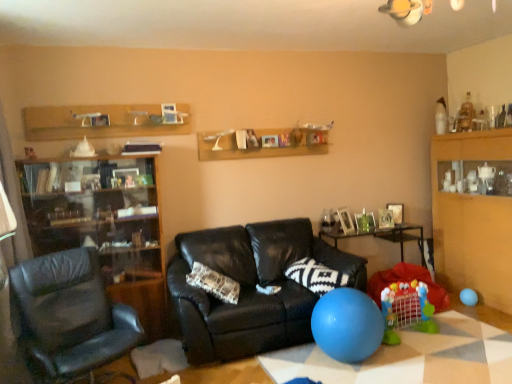
You are a GUI agent. You are given a task and a screenshot of the screen. Output one action in this format:
    pyautogui.click(x=<x>, y=<y>)
    Task: Click on the black leather chair at left
    
    Given the screenshot: What is the action you would take?
    pyautogui.click(x=71, y=316)

The image size is (512, 384). What do you see at coordinates (71, 316) in the screenshot?
I see `black leather chair at left` at bounding box center [71, 316].

In order to face blue rubber balloon at lower center, the 1th balloon from the left, should I rotate leftwards or rightwards?

Turn right by 12.293 degrees to look at blue rubber balloon at lower center, the 1th balloon from the left.

In order to face blue rubber balloon at lower right, positioned as the 1th balloon in back-to-front order, should I rotate leftwards or rightwards?

A 26.725 degree turn to the right will do.

You are a GUI agent. You are given a task and a screenshot of the screen. Output one action in this format:
    pyautogui.click(x=<x>, y=<y>)
    Task: Click on the matte black cabinet at left
    This screenshot has height=384, width=512.
    Given the screenshot: What is the action you would take?
    pyautogui.click(x=103, y=225)

Where is `blue rubber ball at lower center, acting as the second table starting from the top`? Image resolution: width=512 pixels, height=384 pixels. blue rubber ball at lower center, acting as the second table starting from the top is located at coordinates (410, 357).

Image resolution: width=512 pixels, height=384 pixels. What do you see at coordinates (410, 357) in the screenshot? I see `blue rubber ball at lower center, which is counted as the second table, starting from the back` at bounding box center [410, 357].

Where is `black leather couch at center`? black leather couch at center is located at coordinates (251, 288).

From a real-world perspective, between black leather couch at center and wooden glossy table at center, acting as the first table starting from the top, who is vertically higher?

black leather couch at center.

Is black leather couch at center in front of or behind wooden glossy table at center, the 1th table positioned from the back, in the image?

black leather couch at center is in front of wooden glossy table at center, the 1th table positioned from the back.

Can you tell me how much black leather couch at center and wooden glossy table at center, the second table in the front-to-back sequence, differ in facing direction?

4.39 degrees.

Identify the location of table that is the 1st one below the black leather couch at center (from a real-world perspective). The image size is (512, 384). (387, 237).

Who is smaller, blue rubber balloon at lower right, positioned as the 1th balloon in back-to-front order, or blue rubber ball at lower center, which is counted as the second table, starting from the back?

blue rubber balloon at lower right, positioned as the 1th balloon in back-to-front order.

Is blue rubber balloon at lower right, which is the 2th balloon in front-to-back order, further to camera compared to blue rubber ball at lower center, the first table from the front?

Yes, blue rubber balloon at lower right, which is the 2th balloon in front-to-back order, is further from the camera.

Considering the points (461, 301) and (494, 376), which point is in front, point (461, 301) or point (494, 376)?

Point (494, 376)

Consider the image. Are blue rubber balloon at lower right, positioned as the 1th balloon in back-to-front order, and blue rubber ball at lower center, which is the 1th table from bottom to top, making contact?

There is a gap between blue rubber balloon at lower right, positioned as the 1th balloon in back-to-front order, and blue rubber ball at lower center, which is the 1th table from bottom to top.

Is blue rubber balloon at lower center, the 1th balloon from the left, far from wooden glossy table at center, which is counted as the 2th table, starting from the bottom?

Indeed, blue rubber balloon at lower center, the 1th balloon from the left, is not near wooden glossy table at center, which is counted as the 2th table, starting from the bottom.

Which is correct: blue rubber balloon at lower center, the 1th balloon from the left, is inside wooden glossy table at center, the second table in the front-to-back sequence, or outside of it?

blue rubber balloon at lower center, the 1th balloon from the left, lies outside wooden glossy table at center, the second table in the front-to-back sequence.

At what (x,y) coordinates should I click in order to perform the action: click on the 2nd balloon in front of the wooden glossy table at center, which is counted as the 2th table, starting from the bottom. Please return your answer as a coordinate pair (x, y). Looking at the image, I should click on (347, 325).

Does point (340, 284) lie behind point (334, 329)?

Yes, point (340, 284) is farther from viewer.

How far apart are black and white patterned pillow at center and blue rubber balloon at lower center, the 1th balloon positioned from the front?

black and white patterned pillow at center is 14.04 inches away from blue rubber balloon at lower center, the 1th balloon positioned from the front.

Who is bigger, black and white patterned pillow at center or blue rubber balloon at lower center, the 1th balloon positioned from the front?

blue rubber balloon at lower center, the 1th balloon positioned from the front.

How different are the orientations of blue rubber balloon at lower right, placed as the second balloon when sorted from left to right, and wooden glossy table at center, the 1th table positioned from the back, in degrees?

There is a 2.06-degree angle between the facing directions of blue rubber balloon at lower right, placed as the second balloon when sorted from left to right, and wooden glossy table at center, the 1th table positioned from the back.

Can you confirm if blue rubber balloon at lower right, which is the 2th balloon in front-to-back order, is taller than wooden glossy table at center, acting as the first table starting from the top?

In fact, blue rubber balloon at lower right, which is the 2th balloon in front-to-back order, may be shorter than wooden glossy table at center, acting as the first table starting from the top.

Based on the photo, from the image's perspective, is blue rubber balloon at lower right, positioned as the 1th balloon in back-to-front order, located above or below wooden glossy table at center, acting as the first table starting from the top?

blue rubber balloon at lower right, positioned as the 1th balloon in back-to-front order, is situated lower than wooden glossy table at center, acting as the first table starting from the top, in the image.

Looking at this image, between blue rubber balloon at lower right, positioned as the 1th balloon in back-to-front order, and wooden glossy table at center, acting as the first table starting from the top, which one is positioned in front?

blue rubber balloon at lower right, positioned as the 1th balloon in back-to-front order.

In the image, is wooden cabinet at right positioned in front of or behind blue rubber ball at lower center, the first table from the front?

Visually, wooden cabinet at right is located behind blue rubber ball at lower center, the first table from the front.

Does wooden cabinet at right appear on the left side of blue rubber ball at lower center, acting as the second table starting from the top?

In fact, wooden cabinet at right is to the right of blue rubber ball at lower center, acting as the second table starting from the top.

Is wooden cabinet at right shorter than blue rubber ball at lower center, which is the 1th table from bottom to top?

No, wooden cabinet at right is not shorter than blue rubber ball at lower center, which is the 1th table from bottom to top.

Between wooden cabinet at right and blue rubber ball at lower center, the first table from the front, which one has larger size?

Bigger between the two is wooden cabinet at right.

Based on the photo, considering the relative sizes of wooden glossy table at center, the second table in the front-to-back sequence, and black leather couch at center in the image provided, is wooden glossy table at center, the second table in the front-to-back sequence, smaller than black leather couch at center?

Yes.

From the image's perspective, is wooden glossy table at center, acting as the first table starting from the top, located above black leather couch at center?

Correct, wooden glossy table at center, acting as the first table starting from the top, appears higher than black leather couch at center in the image.

In terms of height, does wooden glossy table at center, which is counted as the 2th table, starting from the bottom, look taller or shorter compared to black leather couch at center?

Considering their sizes, wooden glossy table at center, which is counted as the 2th table, starting from the bottom, has less height than black leather couch at center.

Does point (422, 227) appear closer or farther from the camera than point (201, 259)?

Point (422, 227).

At what (x,y) coordinates should I click in order to perform the action: click on table above the black leather couch at center (from the image's perspective). Please return your answer as a coordinate pair (x, y). The width and height of the screenshot is (512, 384). Looking at the image, I should click on (387, 237).

Image resolution: width=512 pixels, height=384 pixels. Find the location of `table in front of the blue rubber balloon at lower right, placed as the second balloon when sorted from left to right`. table in front of the blue rubber balloon at lower right, placed as the second balloon when sorted from left to right is located at coordinates (410, 357).

Considering their positions, is blue rubber ball at lower center, which is the 1th table from bottom to top, positioned closer to black and white patterned pillow at center than wooden glossy table at center, the 1th table positioned from the back?

blue rubber ball at lower center, which is the 1th table from bottom to top, is positioned closer to the anchor black and white patterned pillow at center.

Estimate the real-world distances between objects in this image. Which object is closer to black and white patterned pillow at center, black leather couch at center or blue rubber ball at lower center, which is the 1th table from bottom to top?

black leather couch at center.

When comparing their distances from wooden glossy table at center, the 1th table positioned from the back, does matte black cabinet at left or wooden shelf at upper center seem closer?

wooden shelf at upper center is closer to wooden glossy table at center, the 1th table positioned from the back.

When comparing their distances from blue rubber ball at lower center, the first table from the front, does wooden shelf at upper center or blue rubber balloon at lower center, the 1th balloon positioned from the front, seem further?

Among the two, wooden shelf at upper center is located further to blue rubber ball at lower center, the first table from the front.

When comparing their distances from matte black cabinet at left, does plastic colorful playpen at lower right or blue rubber balloon at lower right, placed as the second balloon when sorted from left to right, seem further?

blue rubber balloon at lower right, placed as the second balloon when sorted from left to right.

Based on the photo, considering their positions, is blue rubber ball at lower center, which is the 1th table from bottom to top, positioned closer to wooden cabinet at right than matte black cabinet at left?

Based on the image, blue rubber ball at lower center, which is the 1th table from bottom to top, appears to be nearer to wooden cabinet at right.

When comparing their distances from wooden shelf at upper center, does matte black cabinet at left or wooden glossy table at center, acting as the first table starting from the top, seem closer?

The object closer to wooden shelf at upper center is matte black cabinet at left.

Looking at the image, which one is located closer to wooden shelf at upper center, plastic colorful playpen at lower right or matte black cabinet at left?

The object closer to wooden shelf at upper center is matte black cabinet at left.

Locate an element on the screen. The image size is (512, 384). pillow between wooden shelf at upper center and black leather couch at center from top to bottom is located at coordinates (316, 276).

Find the location of a particular element. The image size is (512, 384). shelf located between matte black cabinet at left and blue rubber balloon at lower center, the 1th balloon positioned from the front, in the left-right direction is located at coordinates (262, 144).

Where is `balloon between blue rubber ball at lower center, acting as the second table starting from the top, and plastic colorful playpen at lower right, along the z-axis`? The image size is (512, 384). balloon between blue rubber ball at lower center, acting as the second table starting from the top, and plastic colorful playpen at lower right, along the z-axis is located at coordinates (347, 325).

At what (x,y) coordinates should I click in order to perform the action: click on table that lies between wooden shelf at upper center and plastic colorful playpen at lower right from top to bottom. Please return your answer as a coordinate pair (x, y). The image size is (512, 384). Looking at the image, I should click on pos(387,237).